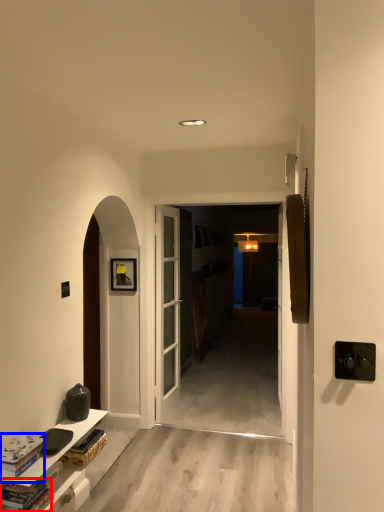
Question: Which of the following is the farthest to the observer, book (highlighted by a red box) or book (highlighted by a blue box)?

Choices:
 (A) book
 (B) book

Answer: (B)